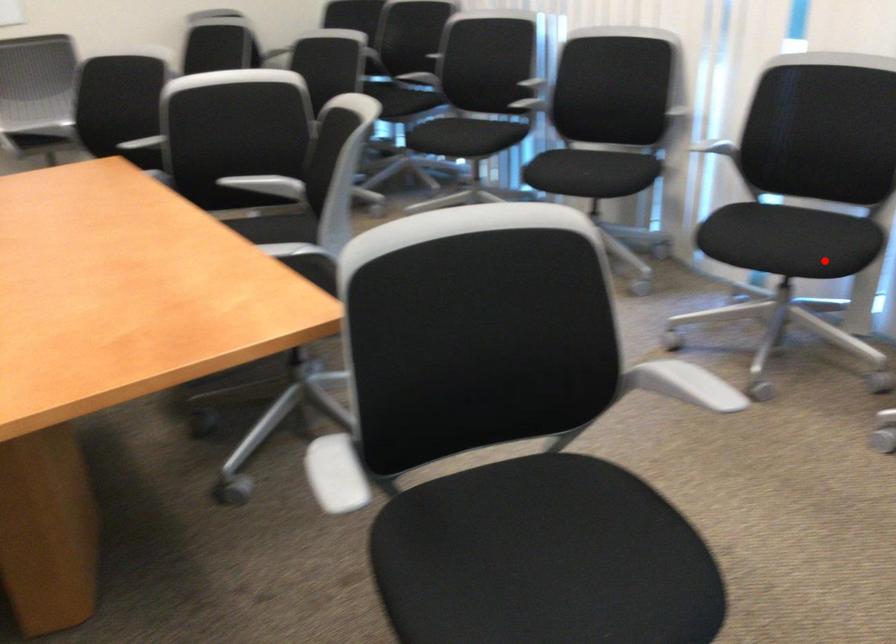
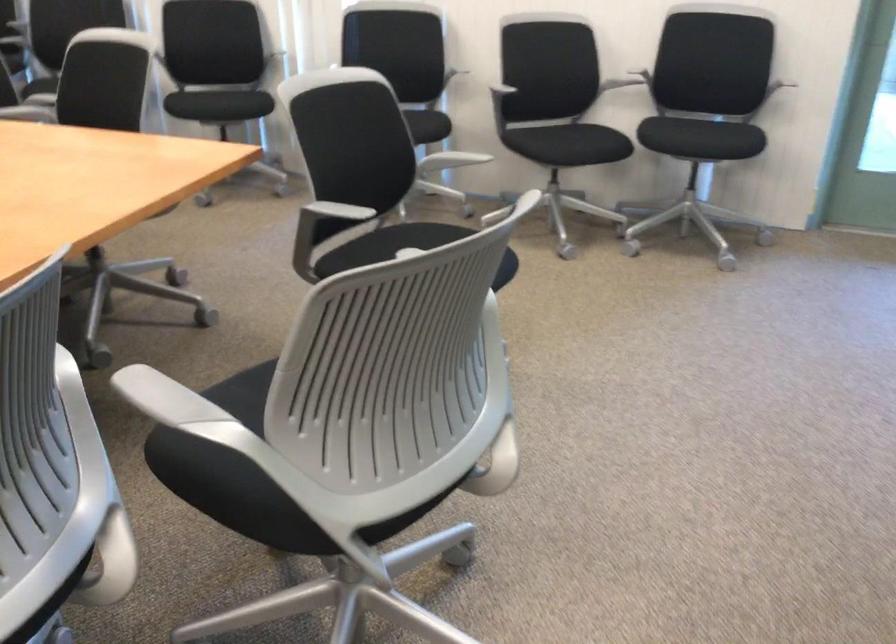
The point at the highlighted location is marked in the first image. Where is the corresponding point in the second image?

(426, 126)